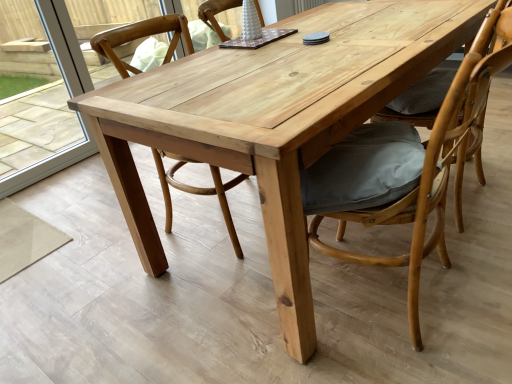
Locate an element on the screen. The image size is (512, 384). wooden cushioned chair at center, arranged as the 2th chair when viewed from the left is located at coordinates (435, 164).

In order to face natural wood chair at center, which is counted as the 1th chair, starting from the left, should I rotate leftwards or rightwards?

Turn left approximately 7.728 degrees to face it.

This screenshot has width=512, height=384. I want to click on matte gray cushion at right, the 3th chair viewed from the left, so click(x=474, y=129).

Find the location of `wooden cushioned chair at center, which is the second chair in right-to-left order`. wooden cushioned chair at center, which is the second chair in right-to-left order is located at coordinates (435, 164).

From the image's perspective, which object appears higher, transparent glass door at left or wooden cushioned chair at center, arranged as the 2th chair when viewed from the left?

transparent glass door at left.

Is there a large distance between transparent glass door at left and wooden cushioned chair at center, which is the second chair in right-to-left order?

transparent glass door at left is far away from wooden cushioned chair at center, which is the second chair in right-to-left order.

How much distance is there between transparent glass door at left and wooden cushioned chair at center, which is the second chair in right-to-left order?

transparent glass door at left is 1.82 meters from wooden cushioned chair at center, which is the second chair in right-to-left order.

Considering the relative positions of transparent glass door at left and wooden cushioned chair at center, which is the second chair in right-to-left order, in the image provided, is transparent glass door at left to the right of wooden cushioned chair at center, which is the second chair in right-to-left order, from the viewer's perspective?

No.

Is transparent glass door at left shorter than natural wood chair at center, which is counted as the 1th chair, starting from the left?

Incorrect, the height of transparent glass door at left does not fall short of that of natural wood chair at center, which is counted as the 1th chair, starting from the left.

Could you tell me if transparent glass door at left is turned towards natural wood chair at center, which is counted as the 1th chair, starting from the left?

Yes.

Would you say transparent glass door at left is inside or outside natural wood chair at center, which is counted as the 1th chair, starting from the left?

transparent glass door at left is not enclosed by natural wood chair at center, which is counted as the 1th chair, starting from the left.

Can you confirm if transparent glass door at left is smaller than natural wood chair at center, which is counted as the 1th chair, starting from the left?

Yes, transparent glass door at left is smaller than natural wood chair at center, which is counted as the 1th chair, starting from the left.

Considering the positions of point (507, 12) and point (440, 208), is point (507, 12) closer or farther from the camera than point (440, 208)?

Point (507, 12) is closer to the camera than point (440, 208).

Is wooden cushioned chair at center, which is the second chair in right-to-left order, at the back of matte gray cushion at right, the 3th chair viewed from the left?

No, matte gray cushion at right, the 3th chair viewed from the left, is not facing away from wooden cushioned chair at center, which is the second chair in right-to-left order.

From the picture: Does matte gray cushion at right, arranged as the 1th chair when viewed from the right, have a greater width compared to wooden cushioned chair at center, arranged as the 2th chair when viewed from the left?

In fact, matte gray cushion at right, arranged as the 1th chair when viewed from the right, might be narrower than wooden cushioned chair at center, arranged as the 2th chair when viewed from the left.

From the picture: Considering the relative sizes of wooden cushioned chair at center, arranged as the 2th chair when viewed from the left, and matte gray cushion at right, the 3th chair viewed from the left, in the image provided, is wooden cushioned chair at center, arranged as the 2th chair when viewed from the left, thinner than matte gray cushion at right, the 3th chair viewed from the left,?

Incorrect, the width of wooden cushioned chair at center, arranged as the 2th chair when viewed from the left, is not less than that of matte gray cushion at right, the 3th chair viewed from the left.

From their relative heights in the image, would you say wooden cushioned chair at center, arranged as the 2th chair when viewed from the left, is taller or shorter than matte gray cushion at right, arranged as the 1th chair when viewed from the right?

Clearly, wooden cushioned chair at center, arranged as the 2th chair when viewed from the left, is shorter compared to matte gray cushion at right, arranged as the 1th chair when viewed from the right.

Is wooden cushioned chair at center, arranged as the 2th chair when viewed from the left, far away from matte gray cushion at right, the 3th chair viewed from the left?

That's not correct — wooden cushioned chair at center, arranged as the 2th chair when viewed from the left, is a little close to matte gray cushion at right, the 3th chair viewed from the left.

Does wooden cushioned chair at center, arranged as the 2th chair when viewed from the left, lie behind matte gray cushion at right, the 3th chair viewed from the left?

No, wooden cushioned chair at center, arranged as the 2th chair when viewed from the left, is closer to the viewer.

How many degrees apart are the facing directions of matte gray cushion at right, the 3th chair viewed from the left, and natural wood chair at center, which is counted as the 1th chair, starting from the left?

They differ by 173 degrees in their facing directions.

Which is in front, point (480, 92) or point (239, 180)?

The point (480, 92) is closer to the camera.

Is matte gray cushion at right, the 3th chair viewed from the left, taller or shorter than natural wood chair at center, the 3th chair from the right?

In the image, matte gray cushion at right, the 3th chair viewed from the left, appears to be shorter than natural wood chair at center, the 3th chair from the right.

Which of these two, wooden cushioned chair at center, arranged as the 2th chair when viewed from the left, or natural wood chair at center, the 3th chair from the right, is bigger?

wooden cushioned chair at center, arranged as the 2th chair when viewed from the left.

From the image's perspective, which one is positioned lower, wooden cushioned chair at center, which is the second chair in right-to-left order, or natural wood chair at center, the 3th chair from the right?

From the image's view, wooden cushioned chair at center, which is the second chair in right-to-left order, is below.

Is point (449, 131) farther from viewer compared to point (172, 50)?

No, it is in front of (172, 50).

Does natural wood chair at center, the 3th chair from the right, have a larger size compared to transparent glass door at left?

Yes.

Is transparent glass door at left at the back of natural wood chair at center, which is counted as the 1th chair, starting from the left?

Correct, natural wood chair at center, which is counted as the 1th chair, starting from the left, is looking away from transparent glass door at left.

Relative to transparent glass door at left, is natural wood chair at center, the 3th chair from the right, in front or behind?

Clearly, natural wood chair at center, the 3th chair from the right, is in front of transparent glass door at left.

This screenshot has height=384, width=512. I want to click on glass door above the wooden cushioned chair at center, which is the second chair in right-to-left order (from the image's perspective), so click(x=64, y=45).

What are the coordinates of `glass door above the natural wood chair at center, which is counted as the 1th chair, starting from the left (from a real-world perspective)` in the screenshot? It's located at (64, 45).

Considering their positions, is matte gray cushion at right, the 3th chair viewed from the left, positioned further to wooden cushioned chair at center, arranged as the 2th chair when viewed from the left, than transparent glass door at left?

transparent glass door at left is positioned further to the anchor wooden cushioned chair at center, arranged as the 2th chair when viewed from the left.

Considering their positions, is matte gray cushion at right, arranged as the 1th chair when viewed from the right, positioned further to wooden cushioned chair at center, which is the second chair in right-to-left order, than natural wood chair at center, the 3th chair from the right?

natural wood chair at center, the 3th chair from the right.

Looking at the image, which one is located further to wooden cushioned chair at center, arranged as the 2th chair when viewed from the left, transparent glass door at left or natural wood chair at center, the 3th chair from the right?

transparent glass door at left is positioned further to the anchor wooden cushioned chair at center, arranged as the 2th chair when viewed from the left.

Which object lies nearer to the anchor point matte gray cushion at right, arranged as the 1th chair when viewed from the right, wooden cushioned chair at center, which is the second chair in right-to-left order, or natural wood chair at center, the 3th chair from the right?

wooden cushioned chair at center, which is the second chair in right-to-left order, is closer to matte gray cushion at right, arranged as the 1th chair when viewed from the right.

Looking at the image, which one is located closer to matte gray cushion at right, arranged as the 1th chair when viewed from the right, transparent glass door at left or natural wood chair at center, which is counted as the 1th chair, starting from the left?

Based on the image, natural wood chair at center, which is counted as the 1th chair, starting from the left, appears to be nearer to matte gray cushion at right, arranged as the 1th chair when viewed from the right.

From the picture: From the image, which object appears to be farther from matte gray cushion at right, the 3th chair viewed from the left, natural wood chair at center, which is counted as the 1th chair, starting from the left, or transparent glass door at left?

Based on the image, transparent glass door at left appears to be further to matte gray cushion at right, the 3th chair viewed from the left.

When comparing their distances from transparent glass door at left, does natural wood chair at center, which is counted as the 1th chair, starting from the left, or matte gray cushion at right, the 3th chair viewed from the left, seem further?

Based on the image, matte gray cushion at right, the 3th chair viewed from the left, appears to be further to transparent glass door at left.

Looking at the image, which one is located further to matte gray cushion at right, arranged as the 1th chair when viewed from the right, transparent glass door at left or wooden cushioned chair at center, arranged as the 2th chair when viewed from the left?

transparent glass door at left lies further to matte gray cushion at right, arranged as the 1th chair when viewed from the right, than the other object.

You are a GUI agent. You are given a task and a screenshot of the screen. Output one action in this format:
    pyautogui.click(x=<x>, y=<y>)
    Task: Click on the chair situated between transparent glass door at left and wooden cushioned chair at center, arranged as the 2th chair when viewed from the left, from left to right
    
    Given the screenshot: What is the action you would take?
    pyautogui.click(x=140, y=37)

This screenshot has height=384, width=512. I want to click on chair located between natural wood chair at center, the 3th chair from the right, and matte gray cushion at right, arranged as the 1th chair when viewed from the right, in the left-right direction, so click(435, 164).